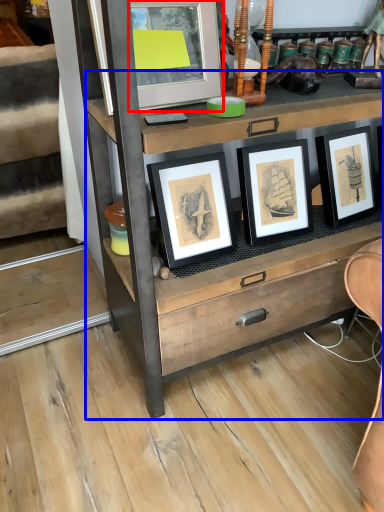
Question: Which object appears closest to the camera in this image, picture frame (highlighted by a red box) or chest of drawers (highlighted by a blue box)?

Choices:
 (A) picture frame
 (B) chest of drawers

Answer: (B)